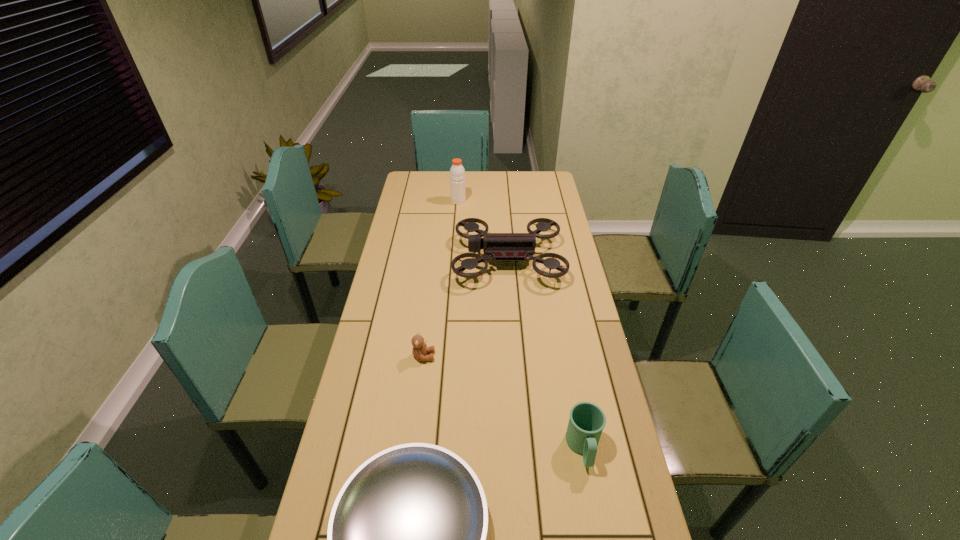
This screenshot has width=960, height=540. Find the location of `free space located 0.120m on the side of the mug with the handle`. free space located 0.120m on the side of the mug with the handle is located at coordinates (597, 523).

Find the location of a particular element. This screenshot has width=960, height=540. free region located 0.300m on the face of the second shortest object is located at coordinates pyautogui.click(x=528, y=356).

Identify the location of drone that is at the right edge. Image resolution: width=960 pixels, height=540 pixels. (508, 247).

Locate an element on the screen. mug present at the right edge is located at coordinates (587, 421).

Where is `free spot at the far edge of the desktop`? The image size is (960, 540). free spot at the far edge of the desktop is located at coordinates (478, 183).

The width and height of the screenshot is (960, 540). Find the location of `free space at the left edge of the desktop`. free space at the left edge of the desktop is located at coordinates (403, 299).

The height and width of the screenshot is (540, 960). In the image, there is a desktop. What are the coordinates of `vacant space at the right edge` in the screenshot? It's located at (558, 317).

Image resolution: width=960 pixels, height=540 pixels. I want to click on vacant region at the far right corner of the desktop, so click(x=548, y=194).

You are a GUI agent. You are given a task and a screenshot of the screen. Output one action in this format:
    pyautogui.click(x=<x>, y=<y>)
    Task: Click on the free spot between the farthest object and the fourth tallest object
    The image size is (960, 540).
    Given the screenshot: What is the action you would take?
    pyautogui.click(x=441, y=279)

Identify the location of free space that is in between the drone and the third nearest object. (466, 308).